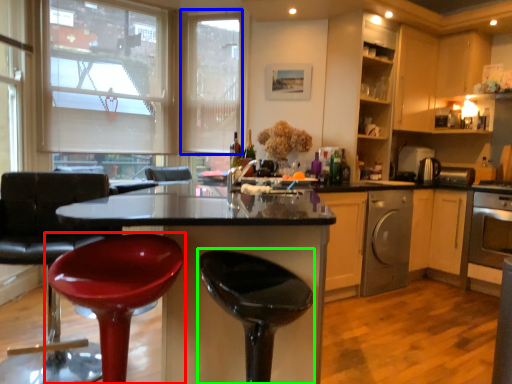
Question: Which object is positioned closest to chair (highlighted by a red box)? Select from window screen (highlighted by a blue box) and bar stool (highlighted by a green box).

Choices:
 (A) window screen
 (B) bar stool

Answer: (B)